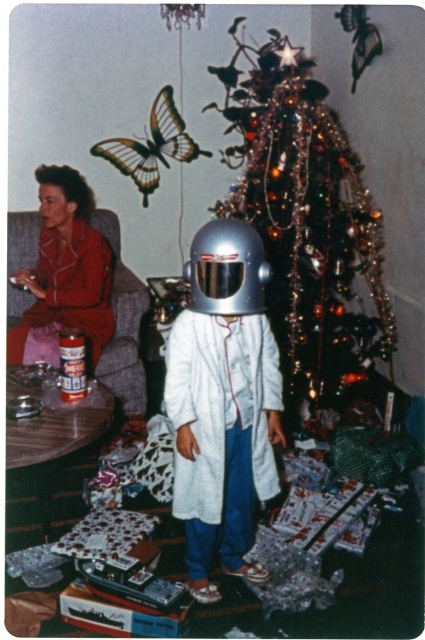
The width and height of the screenshot is (425, 640). I want to click on shiny silver helmet at center, so click(223, 403).

Is shiny silver helmet at center in front of shiny metallic helmet at center?

No, shiny silver helmet at center is further to the viewer.

Locate an element on the screen. This screenshot has width=425, height=640. shiny silver helmet at center is located at coordinates (223, 403).

Between point (302, 294) and point (232, 314), which one is positioned in front?

Point (232, 314) is in front.

Where is `shiny metallic tree at center`? The width and height of the screenshot is (425, 640). shiny metallic tree at center is located at coordinates (306, 220).

The height and width of the screenshot is (640, 425). In order to click on shiny metallic tree at center in this screenshot , I will do `click(306, 220)`.

Based on the photo, who is lower down, matte red pajamas at left or shiny metallic helmet at center?

Positioned lower is shiny metallic helmet at center.

Is point (95, 276) less distant than point (190, 301)?

That is False.

This screenshot has height=640, width=425. What are the coordinates of `matte red pajamas at left` in the screenshot? It's located at coord(64,273).